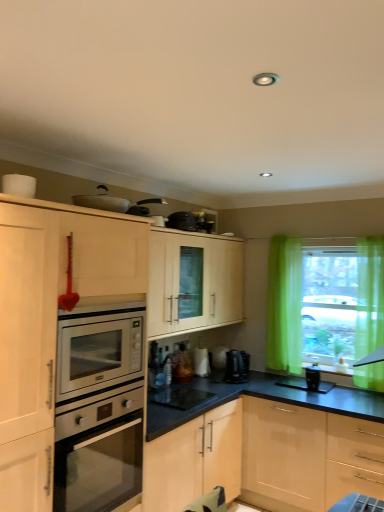
Question: In the image, is translucent glass window sill at lower right positioned in front of or behind metallic silver pan at upper center, positioned as the 3th appliance in back-to-front order?

Choices:
 (A) behind
 (B) front

Answer: (A)

Question: Is point (337, 366) positioned closer to the camera than point (97, 190)?

Choices:
 (A) farther
 (B) closer

Answer: (A)

Question: Estimate the real-world distances between objects in this image. Which object is closer to the silver metallic oven at left?

Choices:
 (A) translucent glass window sill at lower right
 (B) metallic silver pan at upper center, which is the 1th appliance from left to right
 (C) black glossy coffee maker at center, which appears as the 2th appliance when viewed from the left
 (D) black plastic canister at lower right, which appears as the 1th appliance when viewed from the right
 (E) black plastic coffee machine at center

Answer: (C)

Question: Which object is the farthest from the black plastic canister at lower right, marked as the first appliance in a back-to-front arrangement?

Choices:
 (A) black glossy coffee maker at center, which is the first appliance from bottom to top
 (B) silver metallic oven at left
 (C) black plastic coffee machine at center
 (D) green sheer curtains at right
 (E) metallic silver pan at upper center, the first appliance from the front

Answer: (E)